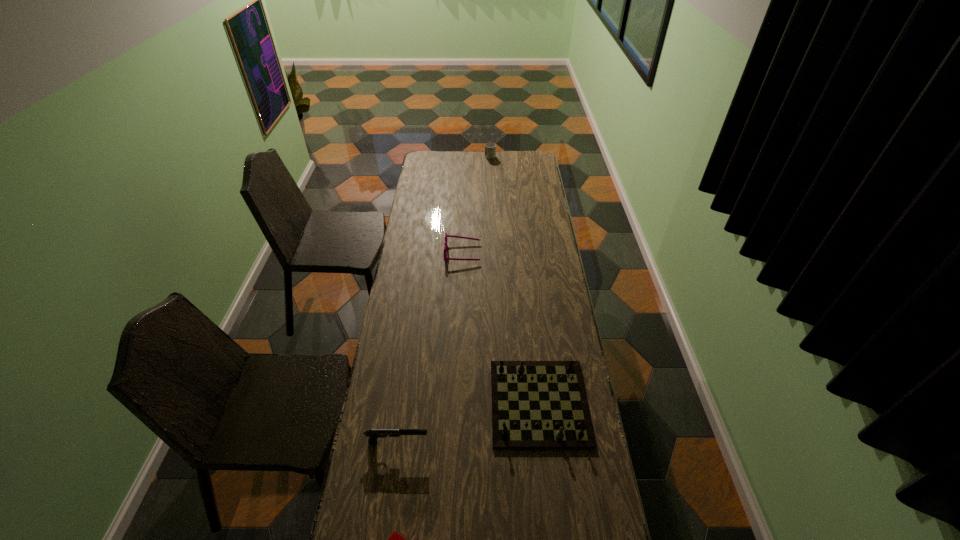
Find the location of `the farthest object`. the farthest object is located at coordinates (490, 148).

Locate an element on the screen. The height and width of the screenshot is (540, 960). gun is located at coordinates (373, 434).

This screenshot has height=540, width=960. Find the location of `spectacles`. spectacles is located at coordinates (445, 243).

This screenshot has width=960, height=540. What are the coordinates of `the second farthest object` in the screenshot? It's located at (445, 243).

Locate an element on the screen. The width and height of the screenshot is (960, 540). chessboard is located at coordinates (535, 404).

The image size is (960, 540). What are the coordinates of `vacant space located 0.380m at the muzzle end of the gun` in the screenshot? It's located at (547, 442).

Where is `vacant space situated 0.200m on the arms of the spectacles`? This screenshot has width=960, height=540. vacant space situated 0.200m on the arms of the spectacles is located at coordinates (523, 253).

What are the coordinates of `vacant space situated on the board of the chessboard` in the screenshot? It's located at click(553, 537).

Where is `object present at the far edge`? The image size is (960, 540). object present at the far edge is located at coordinates (490, 148).

The image size is (960, 540). Identify the location of object that is at the left edge. (373, 434).